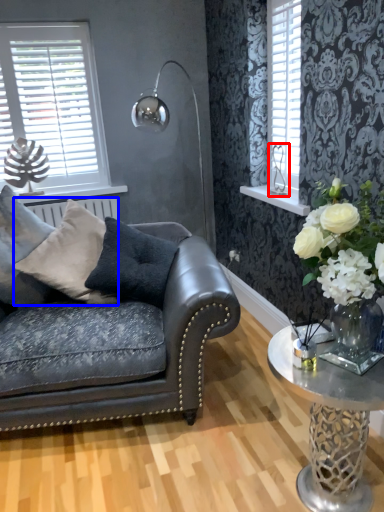
Question: Which object is further to the camera taking this photo, silver (highlighted by a red box) or pillow (highlighted by a blue box)?

Choices:
 (A) silver
 (B) pillow

Answer: (A)